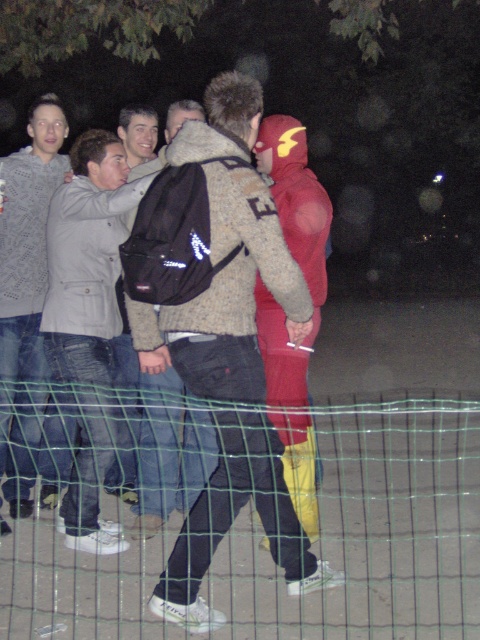
Question: Which point is farther to the camera?

Choices:
 (A) coord(295,476)
 (B) coord(159,241)
 (C) coord(377,573)

Answer: (A)

Question: Is knitted sweater at center closer to the viewer compared to black fabric backpack at center?

Choices:
 (A) no
 (B) yes

Answer: (B)

Question: Among these objects, which one is farthest from the camera?

Choices:
 (A) green mesh fence at lower center
 (B) black fabric backpack at center

Answer: (B)

Question: Which of the following is the farthest from the observer?

Choices:
 (A) red matte costume at center
 (B) black fabric backpack at center

Answer: (B)

Question: Is light gray fabric jacket at center wider than black fabric backpack at center?

Choices:
 (A) no
 (B) yes

Answer: (B)

Question: Can you confirm if green mesh fence at lower center is positioned to the left of light gray fabric jacket at center?

Choices:
 (A) yes
 (B) no

Answer: (B)